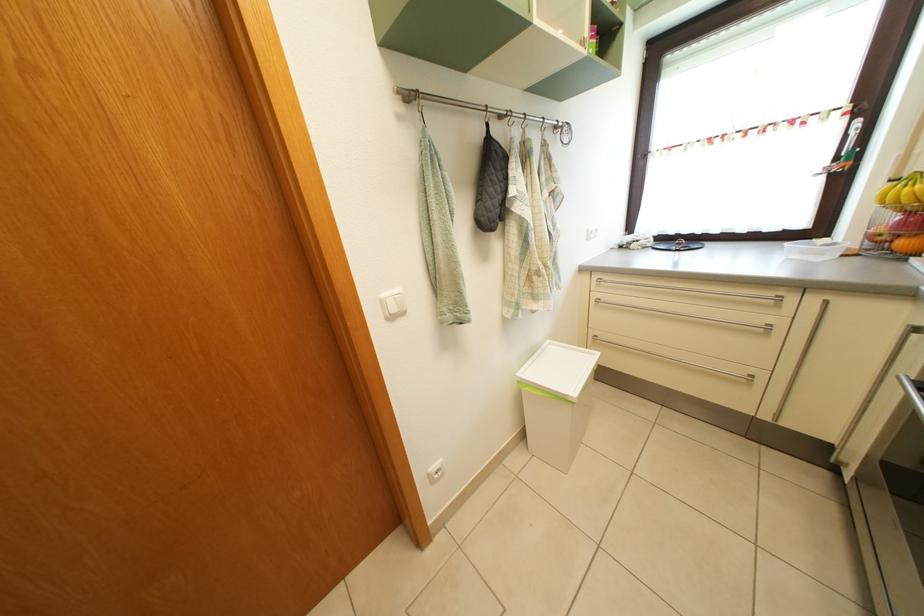
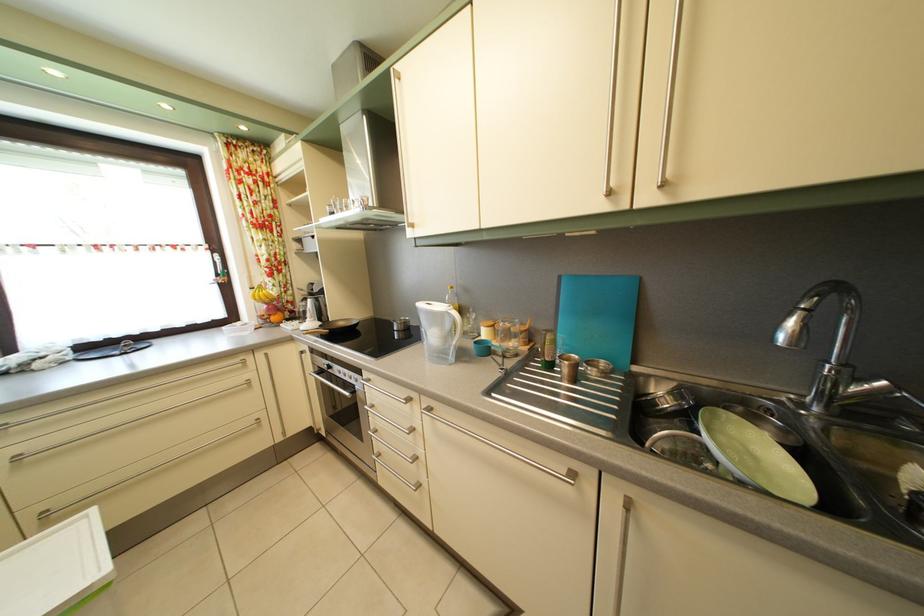
Find the pixel in the second image that matches [821,307] in the first image.

(268, 363)